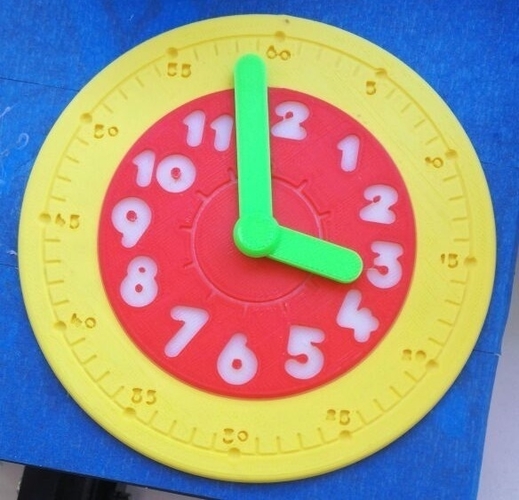
The height and width of the screenshot is (500, 519). Identify the location of toy clock. (248, 229).